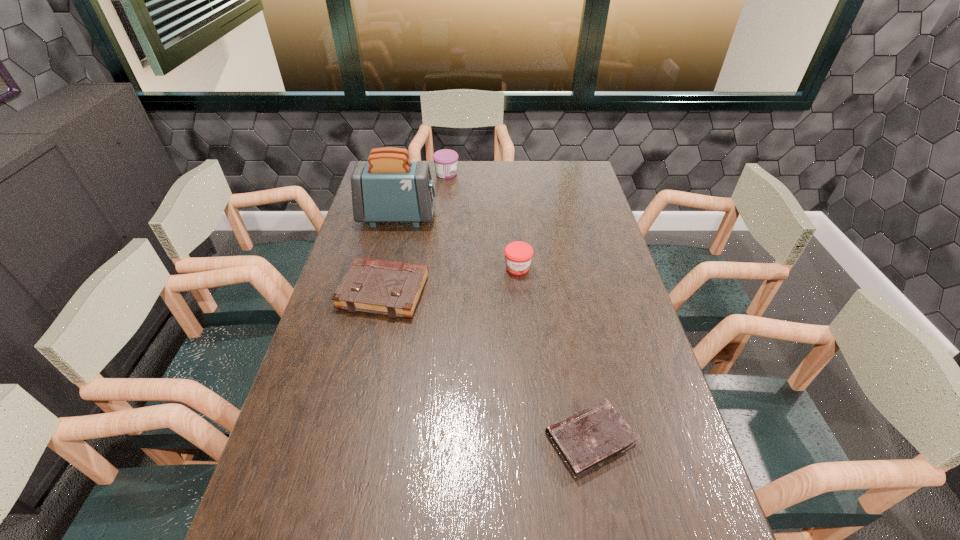
The image size is (960, 540). Find the location of `free space that is in between the diary and the nearer jam`. free space that is in between the diary and the nearer jam is located at coordinates (554, 354).

This screenshot has width=960, height=540. What are the coordinates of `blank region between the fourth tallest object and the fourth nearest object` in the screenshot? It's located at (391, 254).

This screenshot has height=540, width=960. In order to click on free spot between the hardback book and the toaster in this screenshot , I will do `click(391, 254)`.

At what (x,y) coordinates should I click in order to perform the action: click on free space between the hardback book and the left jam. Please return your answer as a coordinate pair (x, y). The height and width of the screenshot is (540, 960). Looking at the image, I should click on (415, 233).

Locate an element on the screen. free space between the shortest object and the fourth nearest object is located at coordinates (493, 328).

Find the location of a particular element. This screenshot has height=540, width=960. vacant area between the third tallest object and the second shortest object is located at coordinates (450, 280).

The height and width of the screenshot is (540, 960). Find the location of `vacant area that lies between the farthest object and the shorter jam`. vacant area that lies between the farthest object and the shorter jam is located at coordinates (482, 221).

At what (x,y) coordinates should I click in order to perform the action: click on free space between the tallest object and the third shortest object. Please return your answer as a coordinate pair (x, y). Looking at the image, I should click on (458, 242).

Identify the location of the second closest object to the tallest object. (391, 288).

You are a GUI agent. You are given a task and a screenshot of the screen. Output one action in this format:
    pyautogui.click(x=<x>, y=<y>)
    Task: Click on the object that is the fourth nearest to the right jam
    
    Given the screenshot: What is the action you would take?
    pyautogui.click(x=445, y=160)